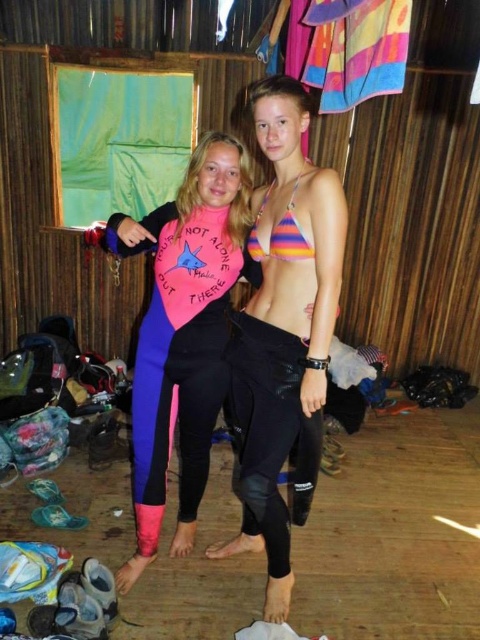
Does pink neoprene wetsuit at center have a smaller size compared to rainbow striped bikini top at center?

No, pink neoprene wetsuit at center is not smaller than rainbow striped bikini top at center.

At what (x,y) coordinates should I click in order to perform the action: click on pink neoprene wetsuit at center. Please return your answer as a coordinate pair (x, y). This screenshot has height=640, width=480. Looking at the image, I should click on (182, 336).

Does point (181, 468) lie in front of point (288, 216)?

No, (181, 468) is further to viewer.

Where is `pink neoprene wetsuit at center`? The width and height of the screenshot is (480, 640). pink neoprene wetsuit at center is located at coordinates (182, 336).

From the picture: Is striped fabric bikini top at center taller than pink neoprene wetsuit at center?

Yes, striped fabric bikini top at center is taller than pink neoprene wetsuit at center.

Between point (275, 413) and point (168, 237), which one is positioned in front?

Positioned in front is point (275, 413).

Between point (268, 104) and point (152, 355), which one is positioned in front?

Positioned in front is point (268, 104).

This screenshot has height=640, width=480. What are the coordinates of `striped fabric bikini top at center` in the screenshot? It's located at (284, 333).

Does striped fabric bikini top at center appear under rainbow striped bikini top at center?

Indeed, striped fabric bikini top at center is positioned under rainbow striped bikini top at center.

Does point (276, 324) come farther from viewer compared to point (292, 225)?

Yes, it is behind point (292, 225).

Which is in front, point (276, 356) or point (286, 211)?

Point (286, 211)

At what (x,y) coordinates should I click in order to perform the action: click on striped fabric bikini top at center. Please return your answer as a coordinate pair (x, y). The image size is (480, 640). Looking at the image, I should click on (284, 333).